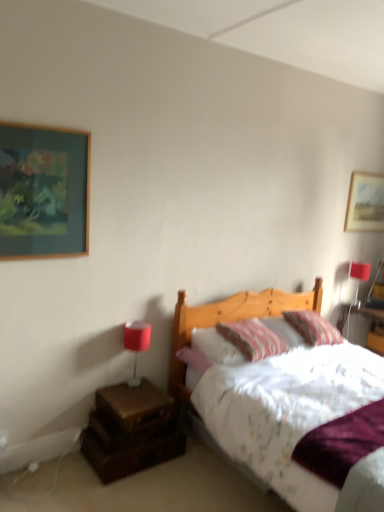
Question: Is matte red lampshade at upper right, which is the 1th table lamp in top-to-bottom order, to the right of matte red table lamp at left, positioned as the 1th table lamp in bottom-to-top order, from the viewer's perspective?

Choices:
 (A) yes
 (B) no

Answer: (A)

Question: Is matte red lampshade at upper right, the 2th table lamp viewed from the left, shorter than matte red table lamp at left, the 1th table lamp when ordered from left to right?

Choices:
 (A) yes
 (B) no

Answer: (A)

Question: Does matte red lampshade at upper right, placed as the 1th table lamp when sorted from right to left, have a larger size compared to matte red table lamp at left, the 1th table lamp when ordered from left to right?

Choices:
 (A) no
 (B) yes

Answer: (A)

Question: Is matte red lampshade at upper right, the 2th table lamp in the bottom-to-top sequence, behind matte red table lamp at left, the 2th table lamp viewed from the right?

Choices:
 (A) no
 (B) yes

Answer: (B)

Question: Is matte red lampshade at upper right, the 2th table lamp viewed from the left, wider than matte red table lamp at left, marked as the 2th table lamp in a top-to-bottom arrangement?

Choices:
 (A) no
 (B) yes

Answer: (B)

Question: Is matte red lampshade at upper right, the 1th table lamp in the back-to-front sequence, thinner than matte red table lamp at left, the 1th table lamp viewed from the front?

Choices:
 (A) no
 (B) yes

Answer: (A)

Question: From the image's perspective, is wooden picture frame at upper right, the second picture frame from the front, beneath matte red lampshade at upper right, the 2th table lamp viewed from the left?

Choices:
 (A) no
 (B) yes

Answer: (A)

Question: Can you confirm if wooden picture frame at upper right, which is the first picture frame in back-to-front order, is bigger than matte red lampshade at upper right, placed as the 1th table lamp when sorted from right to left?

Choices:
 (A) yes
 (B) no

Answer: (A)

Question: Can you confirm if wooden picture frame at upper right, which is the first picture frame in back-to-front order, is taller than matte red lampshade at upper right, which is the 1th table lamp in top-to-bottom order?

Choices:
 (A) no
 (B) yes

Answer: (B)

Question: From a real-world perspective, is wooden picture frame at upper right, which ranks as the 2th picture frame in left-to-right order, under matte red lampshade at upper right, the 1th table lamp in the back-to-front sequence?

Choices:
 (A) no
 (B) yes

Answer: (A)

Question: Considering the relative sizes of wooden picture frame at upper right, which is counted as the 1th picture frame, starting from the right, and matte red lampshade at upper right, the 2th table lamp viewed from the left, in the image provided, is wooden picture frame at upper right, which is counted as the 1th picture frame, starting from the right, thinner than matte red lampshade at upper right, the 2th table lamp viewed from the left,?

Choices:
 (A) no
 (B) yes

Answer: (B)

Question: Is wooden picture frame at upper right, which is the first picture frame in back-to-front order, placed right next to matte red lampshade at upper right, the 2th table lamp viewed from the left?

Choices:
 (A) no
 (B) yes

Answer: (A)

Question: From a real-world perspective, is brown wooden nightstand at lower left under wooden picture frame at upper right, the second picture frame from the front?

Choices:
 (A) no
 (B) yes

Answer: (B)